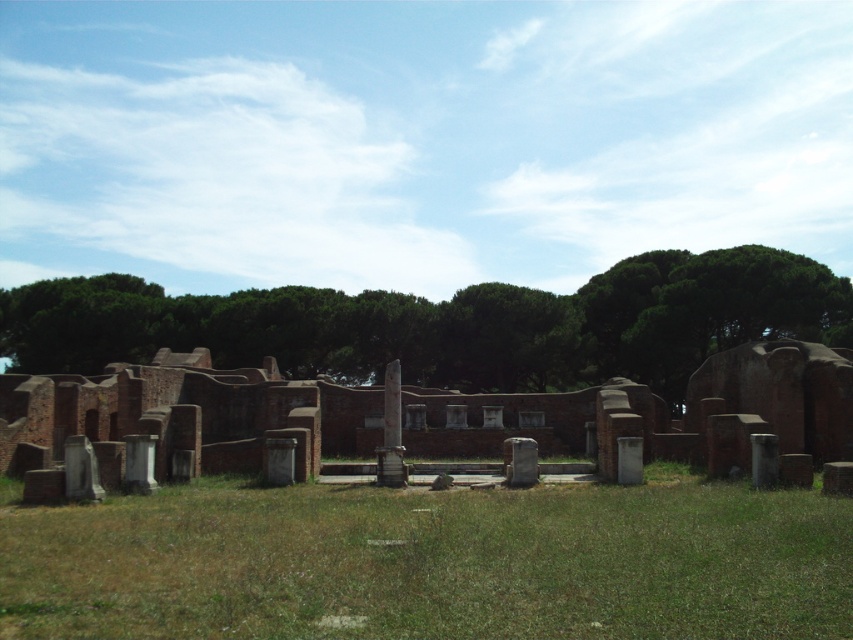
You are an archaeologist examining the site. You see the green grass at center and the green leafy tree at center. Which object is positioned to the right of the other?

The green grass at center is to the right of the green leafy tree at center.

You are standing at the point marked as point (431, 561) in the archaeological site. Looking around, you see green grass at center. Which direction should you walk to reach the ancient brick structures in the middle ground?

The ancient brick structures in the middle ground are located behind the green grass at center. Since you are standing at point (431, 561) where the green grass at center is situated, you should walk forward towards the middle ground to reach the ancient brick structures.